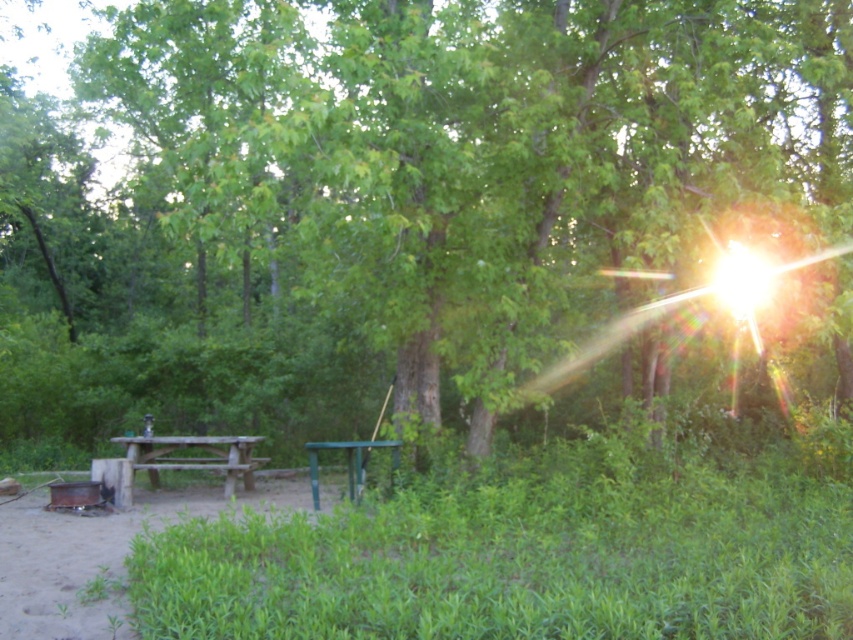
You are standing at the center of the campsite and want to place a new bench exactly at the point labeled as point (x=195, y=458). Based on the scene description, where should you position the bench?

The point (x=195, y=458) corresponds to the wooden picnic table at left, so you should place the bench near the wooden picnic table at left.

You are standing at the campsite and want to place your backpack on the closest table. Which table should you choose between the wooden picnic table at left and the green plastic table at center?

You should choose the wooden picnic table at left because it is closer to you than the green plastic table at center.

You are standing at the center of the campsite and want to place a new bench exactly 0.5 meters to the right of the wooden picnic table at left. Given the 2D coordinates provided, can you determine the new coordinates for the bench?

The wooden picnic table at left is located at coordinates (195, 458). To place the bench 0.5 meters to the right, add 0.5 to the x coordinate, resulting in new coordinates of (195, 639).